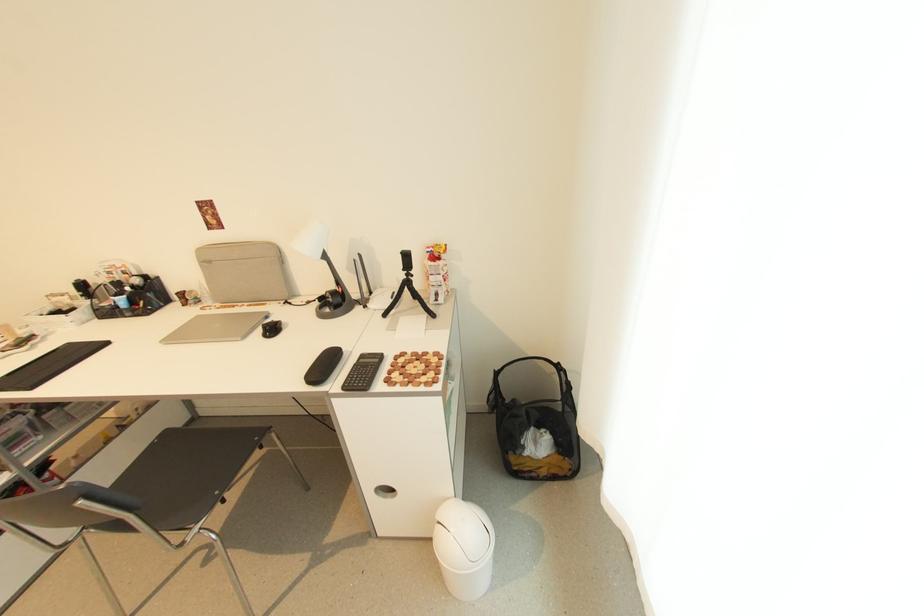
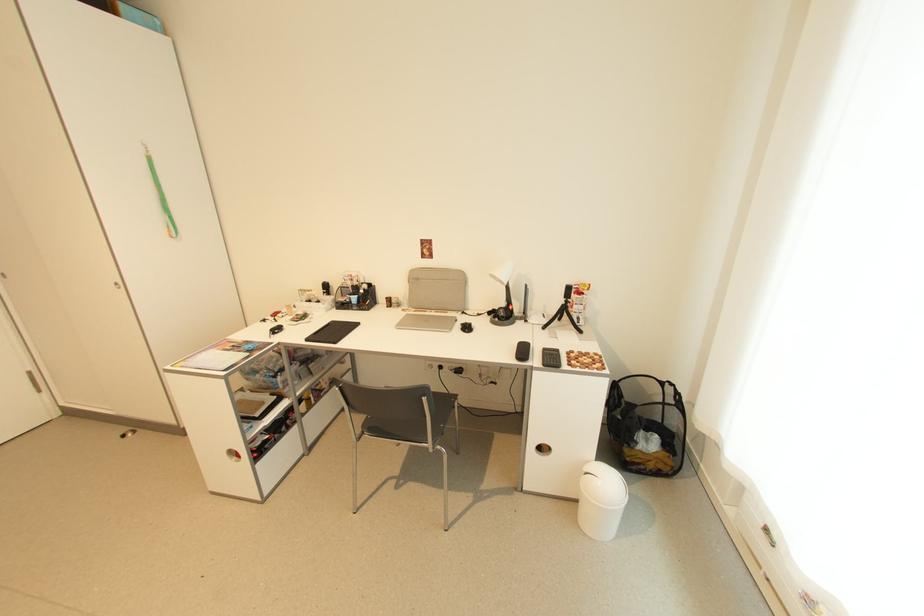
Where in the second image is the point corresponding to [214,264] from the first image?

(422, 281)